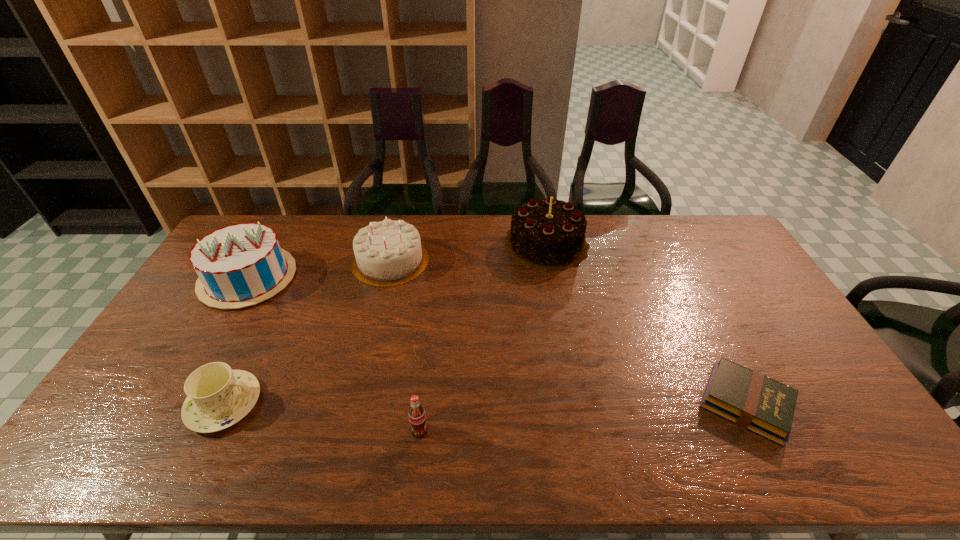
Locate an element on the screen. Image resolution: width=960 pixels, height=540 pixels. vacant position in the image that satisfies the following two spatial constraints: 1. on the back side of the soda; 2. on the handle side of the chinaware is located at coordinates (422, 403).